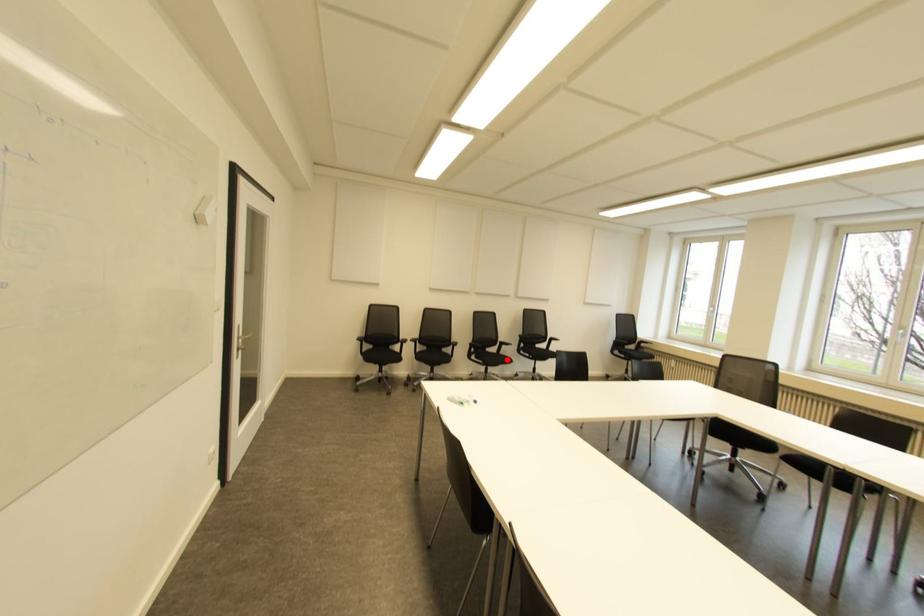
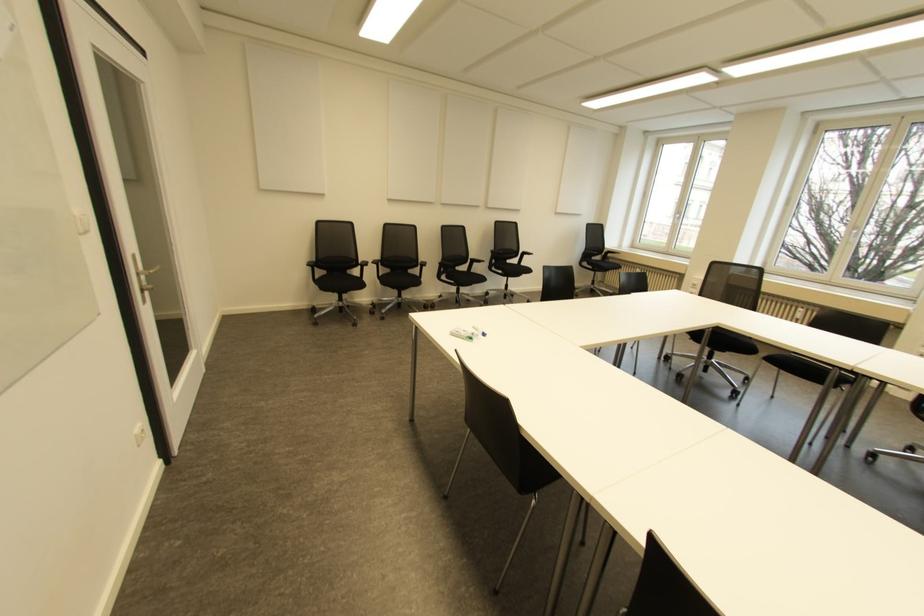
Question: I am providing you with two images of the same scene from different viewpoints. Image1 has a red point marked. In image2, the corresponding 3D location appears at what relative position? Reply with the corresponding letter.

Choices:
 (A) Closer
 (B) Farther

Answer: (A)